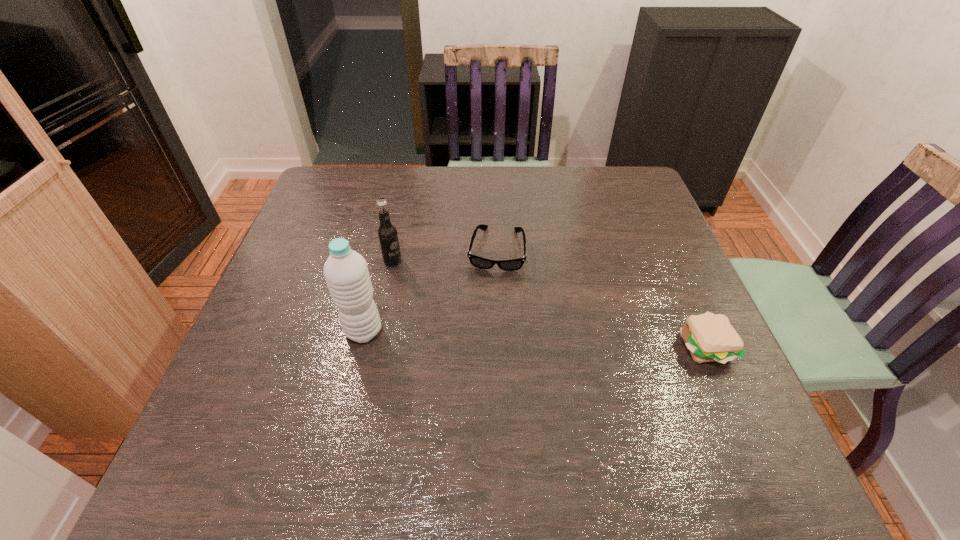
Locate an element on the screen. free point between the water bottle and the shortest object is located at coordinates click(x=430, y=291).

Where is `blank region between the second object from right to left and the third shortest object`? blank region between the second object from right to left and the third shortest object is located at coordinates (444, 255).

The height and width of the screenshot is (540, 960). What are the coordinates of `vacant area that lies between the third tallest object and the shortest object` in the screenshot? It's located at [x=601, y=298].

Find the location of a particular element. empty space that is in between the second shortest object and the third object from left to right is located at coordinates (601, 298).

Locate an element on the screen. Image resolution: width=960 pixels, height=540 pixels. free spot between the root beer and the water bottle is located at coordinates [378, 296].

This screenshot has width=960, height=540. Identify the location of free space between the third shortest object and the tallest object. (378, 296).

The image size is (960, 540). Identify the location of free area in between the third tallest object and the shortest object. (601, 298).

Identify the location of free space between the patty and the tallest object. The height and width of the screenshot is (540, 960). (535, 339).

Image resolution: width=960 pixels, height=540 pixels. What are the coordinates of `free point between the shortest object and the third shortest object` in the screenshot? It's located at (444, 255).

Identify which object is located as the nearest to the sunglasses. Please provide its 2D coordinates. Your answer should be formatted as a tuple, i.e. [(x, y)], where the tuple contains the x and y coordinates of a point satisfying the conditions above.

[(387, 234)]